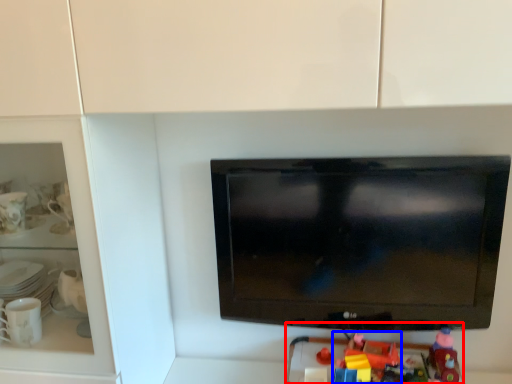
Question: Which of the following is the farthest to the observer, toy (highlighted by a red box) or toy (highlighted by a blue box)?

Choices:
 (A) toy
 (B) toy

Answer: (B)